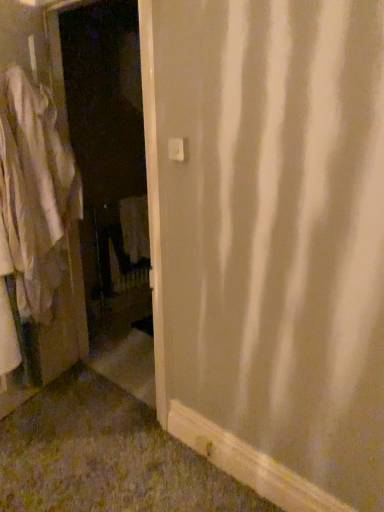
In order to click on white cotton shirt at left in this screenshot , I will do `click(35, 189)`.

The width and height of the screenshot is (384, 512). What do you see at coordinates (35, 189) in the screenshot? I see `white cotton shirt at left` at bounding box center [35, 189].

What are the coordinates of `white matte screen door at left` in the screenshot? It's located at (113, 128).

What is the approximate width of white matte screen door at left?

6.59 inches.

This screenshot has width=384, height=512. What do you see at coordinates (113, 128) in the screenshot?
I see `white matte screen door at left` at bounding box center [113, 128].

This screenshot has width=384, height=512. Find the location of `white cotton shirt at left`. white cotton shirt at left is located at coordinates (35, 189).

Which object is positioned more to the left, white matte screen door at left or white cotton shirt at left?

white cotton shirt at left.

Is white matte screen door at left positioned in front of white cotton shirt at left?

Yes, white matte screen door at left is closer to the viewer.

Considering the positions of point (110, 187) and point (6, 214), is point (110, 187) closer or farther from the camera than point (6, 214)?

Point (110, 187) is farther from the camera than point (6, 214).

From the image's perspective, is white matte screen door at left located above white cotton shirt at left?

Yes, from the image's perspective, white matte screen door at left is on top of white cotton shirt at left.

From a real-world perspective, which object stands above the other?

In real-world perspective, white cotton shirt at left is above.

Which object is thinner, white matte screen door at left or white cotton shirt at left?

white matte screen door at left is thinner.

Which of these two, white matte screen door at left or white cotton shirt at left, stands shorter?

Standing shorter between the two is white cotton shirt at left.

Is white matte screen door at left bigger than white cotton shirt at left?

Yes, white matte screen door at left is bigger than white cotton shirt at left.

Would you say white matte screen door at left is outside white cotton shirt at left?

white matte screen door at left lies outside white cotton shirt at left's area.

Does white matte screen door at left touch white cotton shirt at left?

No, white matte screen door at left is not next to white cotton shirt at left.

From the picture: Is white matte screen door at left turned away from white cotton shirt at left?

That's right, white matte screen door at left is facing away from white cotton shirt at left.

Can you tell me how much white matte screen door at left and white cotton shirt at left differ in facing direction?

The angle between the facing direction of white matte screen door at left and the facing direction of white cotton shirt at left is 108 degrees.

You are a GUI agent. You are given a task and a screenshot of the screen. Output one action in this format:
    pyautogui.click(x=<x>, y=<y>)
    Task: Click on the clothing that is below the white matte screen door at left (from the image's perspective)
    The width and height of the screenshot is (384, 512).
    Given the screenshot: What is the action you would take?
    pyautogui.click(x=35, y=189)

From the picture: Visually, is white cotton shirt at left positioned to the left or to the right of white matte screen door at left?

white cotton shirt at left is positioned on white matte screen door at left's left side.

Is the depth of white cotton shirt at left greater than that of white matte screen door at left?

Yes, white cotton shirt at left is further from the camera.

Considering the points (60, 137) and (152, 200), which point is in front, point (60, 137) or point (152, 200)?

Point (152, 200)

From the image's perspective, would you say white cotton shirt at left is positioned over white matte screen door at left?

No, from the image's perspective, white cotton shirt at left is not on top of white matte screen door at left.

From a real-world perspective, is white cotton shirt at left above or below white matte screen door at left?

Clearly, from a real-world perspective, white cotton shirt at left is above white matte screen door at left.

Which of these two, white cotton shirt at left or white matte screen door at left, is wider?

Wider between the two is white cotton shirt at left.

Is white cotton shirt at left taller than white matte screen door at left?

No, white cotton shirt at left is not taller than white matte screen door at left.

Which of these two, white cotton shirt at left or white matte screen door at left, is bigger?

white matte screen door at left is bigger.

Can we say white cotton shirt at left lies outside white matte screen door at left?

Yes, white cotton shirt at left is not within white matte screen door at left.

Is there a large distance between white cotton shirt at left and white matte screen door at left?

No, white cotton shirt at left is not far away from white matte screen door at left.

Could you tell me if white cotton shirt at left is facing white matte screen door at left?

Yes, white cotton shirt at left is turned towards white matte screen door at left.

What's the angular difference between white cotton shirt at left and white matte screen door at left's facing directions?

The angular difference between white cotton shirt at left and white matte screen door at left is 108 degrees.

Locate an element on the screen. clothing lying on the left of white matte screen door at left is located at coordinates (35, 189).

Find the location of a particular element. clothing located below the white matte screen door at left (from the image's perspective) is located at coordinates click(x=35, y=189).

Find the location of `screen door above the white cotton shirt at left (from the image's perspective)`. screen door above the white cotton shirt at left (from the image's perspective) is located at coordinates (113, 128).